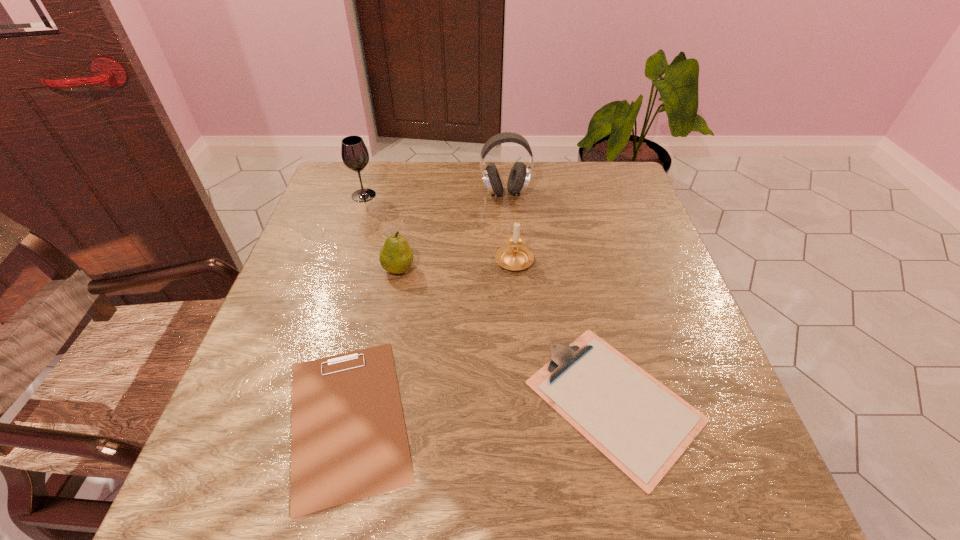
Locate an element on the screen. the fourth closest object to the candle holder is located at coordinates (348, 442).

The image size is (960, 540). Find the location of `object that stands as the fourth closest to the pear`. object that stands as the fourth closest to the pear is located at coordinates (519, 176).

Where is `vacant space that satisfies the following two spatial constraints: 1. on the back side of the fifth tallest object; 2. on the left side of the shorter clipboard`? This screenshot has width=960, height=540. vacant space that satisfies the following two spatial constraints: 1. on the back side of the fifth tallest object; 2. on the left side of the shorter clipboard is located at coordinates (352, 401).

You are a GUI agent. You are given a task and a screenshot of the screen. Output one action in this format:
    pyautogui.click(x=<x>, y=<y>)
    Task: Click on the free spot that satisfies the following two spatial constraints: 1. on the front side of the pear; 2. on the left side of the wineglass
    The image size is (960, 540).
    Given the screenshot: What is the action you would take?
    pyautogui.click(x=340, y=269)